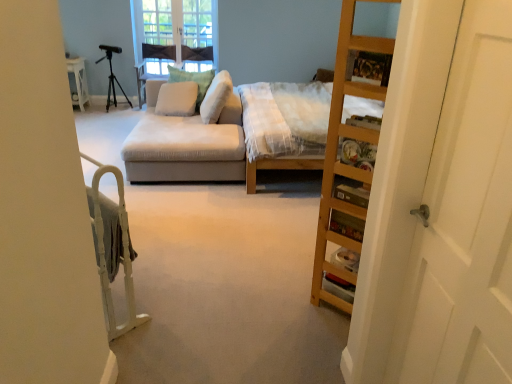
Locate an element on the screen. The image size is (512, 384). vacant area located to the right-hand side of white wood bed frame at left is located at coordinates (184, 299).